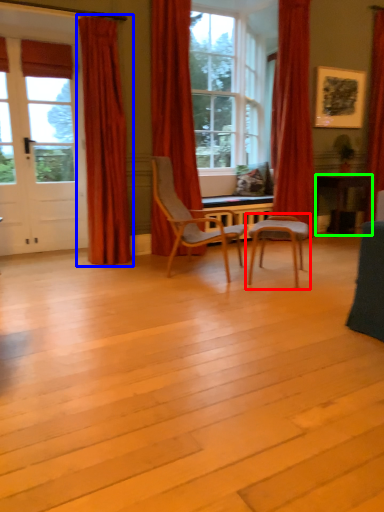
Question: Which object is positioned closest to chair (highlighted by a red box)? Select from curtain (highlighted by a blue box) and desk (highlighted by a green box).

Choices:
 (A) curtain
 (B) desk

Answer: (A)